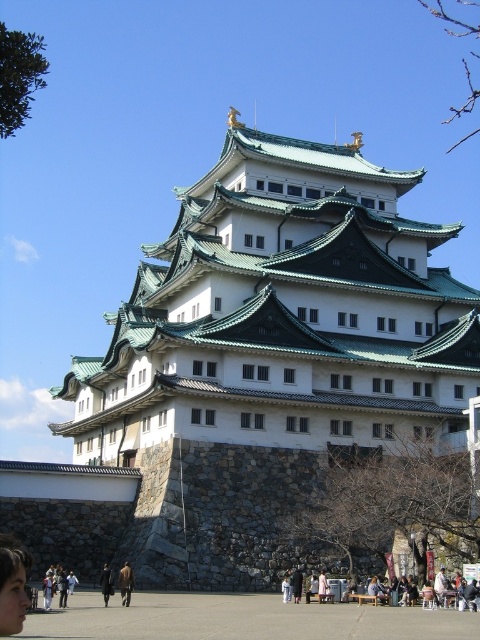
You are a tour guide explaining the castle grounds to visitors. You notice two visitors wearing a brown leather jacket at lower center and a dark brown leather coat at center. Which visitor is positioned more to the east side of the paved area?

The brown leather jacket at lower center is positioned to the right of the dark brown leather coat at center. Since the castle is facing the paved area, the right side corresponds to the east direction. Therefore, the brown leather jacket at lower center is more to the east side of the paved area.

You are standing in front of the castle and want to take a photo of the smooth skin face at lower left. Where should you aim your camera to capture the face?

You should aim your camera at point [12,589] to capture the smooth skin face at lower left.

You are a tour guide leading a group near the castle. You notice a visitor is holding the brown leather jacket at lower center and another visitor is holding the dark brown leather coat at center. You want to ensure they can safely pass each other without bumping into each other. What is the minimum distance they need to maintain between them?

The brown leather jacket at lower center is 4.38 feet away from the dark brown leather coat at center. To safely pass each other without bumping, they should maintain a distance of at least 4.38 feet between them.